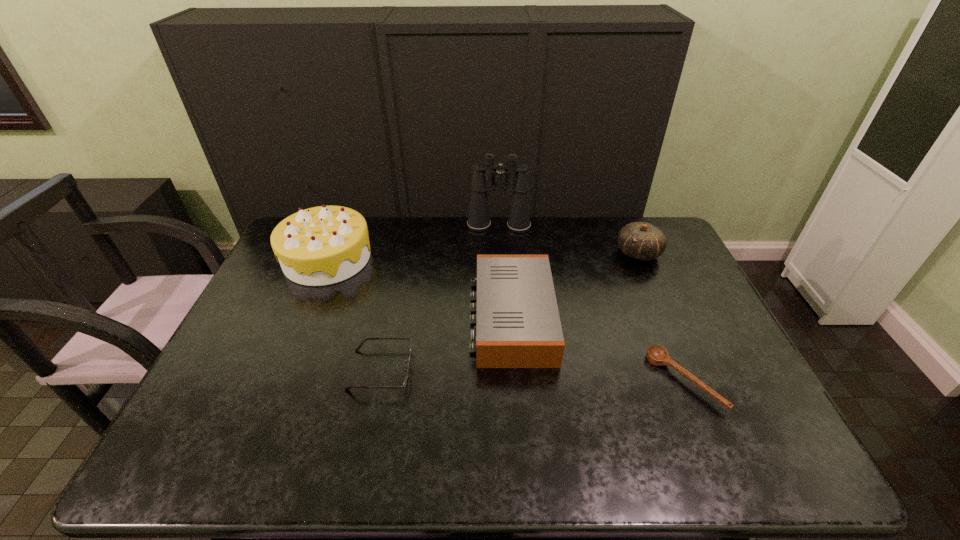
Find the location of a particular element. gourd located at the right edge is located at coordinates (640, 240).

Locate an element on the screen. This screenshot has height=540, width=960. wooden spoon at the right edge is located at coordinates (656, 355).

I want to click on object at the far left corner, so click(323, 245).

The image size is (960, 540). In order to click on object situated at the far right corner in this screenshot , I will do `click(640, 240)`.

You are a GUI agent. You are given a task and a screenshot of the screen. Output one action in this format:
    pyautogui.click(x=<x>, y=<y>)
    Task: Click on the vacant point at the far edge
    This screenshot has height=540, width=960.
    Given the screenshot: What is the action you would take?
    pyautogui.click(x=585, y=233)

Where is `vacant space at the near edge of the desktop`? vacant space at the near edge of the desktop is located at coordinates (486, 457).

Locate an element on the screen. The image size is (960, 540). vacant area at the left edge of the desktop is located at coordinates (262, 334).

The height and width of the screenshot is (540, 960). I want to click on free space at the right edge, so click(x=707, y=399).

Where is `vacant space at the far right corner`? Image resolution: width=960 pixels, height=540 pixels. vacant space at the far right corner is located at coordinates (665, 225).

You are a GUI agent. You are given a task and a screenshot of the screen. Output one action in this format:
    pyautogui.click(x=<x>, y=<y>)
    Task: Click on the free space at the near right corner of the desktop
    The width and height of the screenshot is (960, 540).
    Given the screenshot: What is the action you would take?
    pyautogui.click(x=749, y=471)